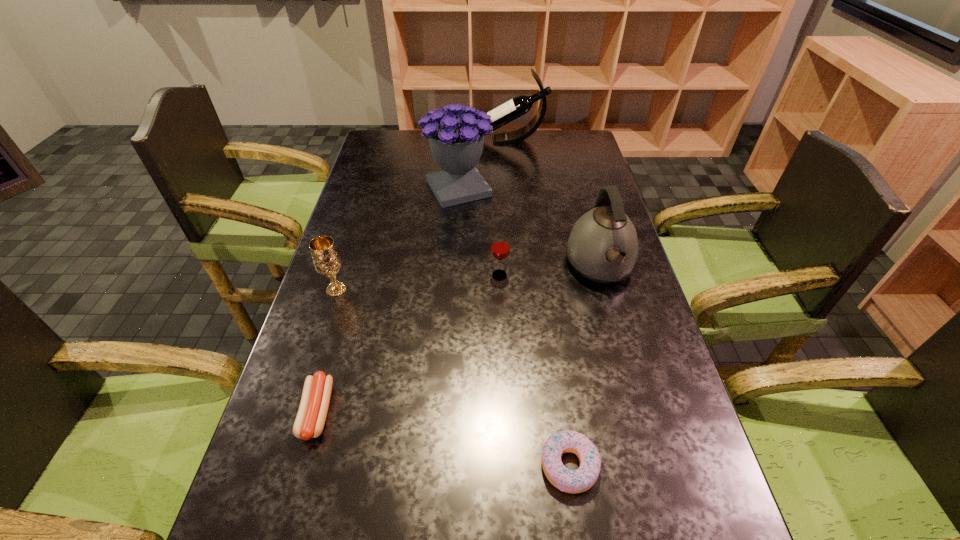
Where is `kettle that is at the right edge`? The width and height of the screenshot is (960, 540). kettle that is at the right edge is located at coordinates (603, 246).

Image resolution: width=960 pixels, height=540 pixels. Identify the location of object located in the far right corner section of the desktop. (520, 105).

At what (x,y) coordinates should I click in order to perform the action: click on vacant space at the far edge of the desktop. Please return your answer as a coordinate pair (x, y). Looking at the image, I should click on (489, 137).

Where is `free region at the left edge of the desktop`? free region at the left edge of the desktop is located at coordinates (371, 298).

In order to click on vacant space at the right edge in this screenshot , I will do `click(577, 163)`.

What are the coordinates of `free spot at the far left corner of the desktop` in the screenshot? It's located at (408, 140).

Locate an element on the screen. free space between the fourth tallest object and the doughnut is located at coordinates (453, 377).

What are the coordinates of `unoccupied area between the sixth nearest object and the doughnut` in the screenshot? It's located at (514, 327).

Image resolution: width=960 pixels, height=540 pixels. I want to click on empty location between the bouquet and the sausage, so click(x=388, y=300).

I want to click on vacant space that is in between the chalice and the sausage, so click(326, 350).